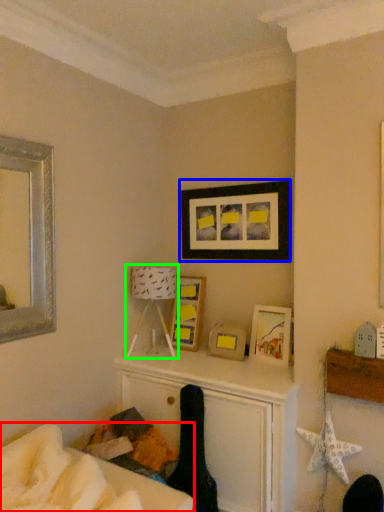
Question: Which object is the farthest from furniture (highlighted by a red box)? Choose among these: picture frame (highlighted by a blue box) or table lamp (highlighted by a green box).

Choices:
 (A) picture frame
 (B) table lamp

Answer: (A)